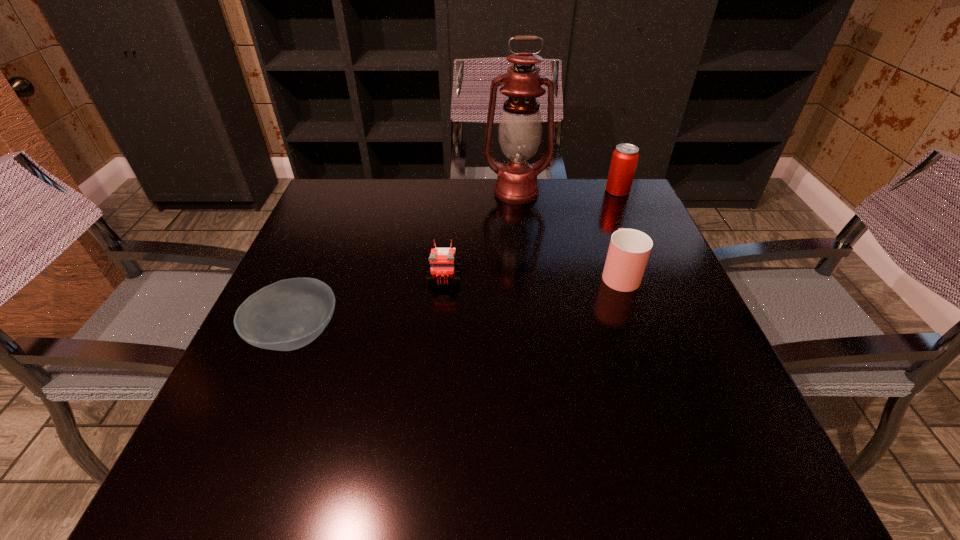
Locate an element on the screen. oil lamp is located at coordinates (520, 128).

Where is `the third object from right to left`? This screenshot has height=540, width=960. the third object from right to left is located at coordinates (520, 128).

At what (x,y) coordinates should I click in order to perform the action: click on can. Please return your answer as a coordinate pair (x, y). Image resolution: width=960 pixels, height=540 pixels. Looking at the image, I should click on (625, 157).

I want to click on the fourth shortest object, so click(x=625, y=157).

This screenshot has height=540, width=960. I want to click on the third shortest object, so click(629, 249).

Locate an element on the screen. cup is located at coordinates (629, 249).

This screenshot has height=540, width=960. I want to click on Lego, so click(x=442, y=261).

At what (x,y) coordinates should I click in order to perform the action: click on the leftmost object. Please return your answer as a coordinate pair (x, y). Looking at the image, I should click on (289, 314).

Where is `the nearest object`? the nearest object is located at coordinates (289, 314).

Find the location of `blank area located on the left of the oil lamp`. blank area located on the left of the oil lamp is located at coordinates (420, 192).